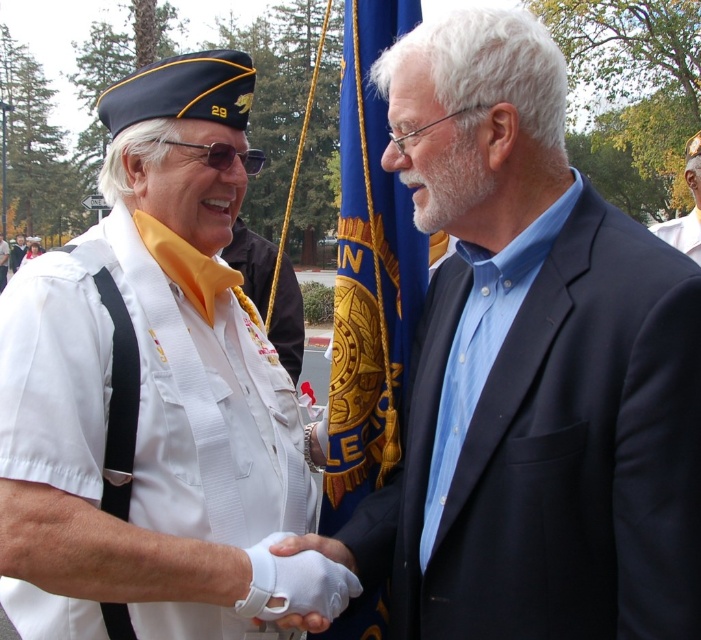
Question: Is blue cotton shirt at center smaller than blue fabric flag at center?

Choices:
 (A) no
 (B) yes

Answer: (A)

Question: Is white fabric uniform at left further to camera compared to white matte uniform at upper right?

Choices:
 (A) no
 (B) yes

Answer: (A)

Question: Is white fabric uniform at left wider than white matte uniform at upper right?

Choices:
 (A) no
 (B) yes

Answer: (A)

Question: Among these points, which one is farthest from the camera?

Choices:
 (A) (700, 172)
 (B) (697, 380)
 (C) (168, 448)
 (D) (414, 237)

Answer: (A)

Question: Which of the following is the closest to the observer?

Choices:
 (A) (667, 234)
 (B) (653, 435)

Answer: (B)

Question: Which of the following is the farthest from the observer?

Choices:
 (A) (411, 488)
 (B) (362, 387)
 (C) (243, 324)

Answer: (B)